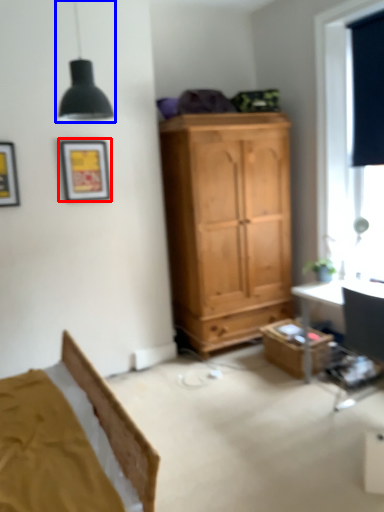
Question: Which object appears closest to the camera in this image, picture frame (highlighted by a red box) or light fixture (highlighted by a blue box)?

Choices:
 (A) picture frame
 (B) light fixture

Answer: (B)